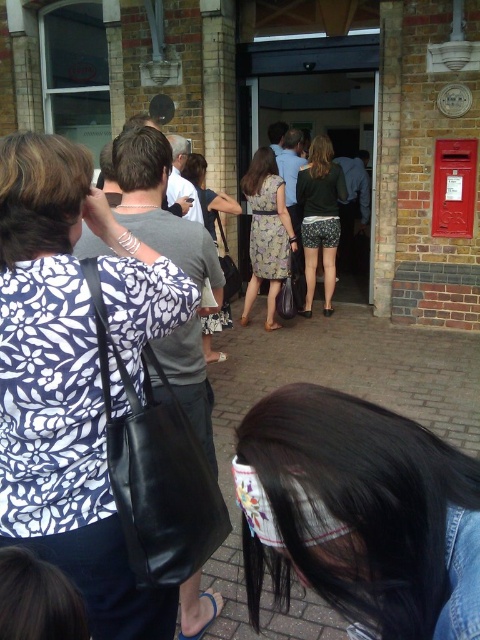
Between black leather hair at center and floral dress at center, which one is positioned higher?

floral dress at center

Does black leather hair at center have a greater width compared to floral dress at center?

Incorrect, black leather hair at center's width does not surpass floral dress at center's.

The width and height of the screenshot is (480, 640). I want to click on black leather hair at center, so click(359, 515).

Is black leather hair at center closer to camera compared to dusty floral dress at center?

Yes, black leather hair at center is closer to the viewer.

Who is higher up, black leather hair at center or dusty floral dress at center?

dusty floral dress at center is above.

The image size is (480, 640). What do you see at coordinates (359, 515) in the screenshot? I see `black leather hair at center` at bounding box center [359, 515].

The width and height of the screenshot is (480, 640). I want to click on black leather hair at center, so point(359,515).

Is floral fabric dress at center closer to the viewer compared to dusty floral dress at center?

That is False.

Between point (331, 195) and point (225, 269), which one is positioned in front?

Point (225, 269)

The image size is (480, 640). What are the coordinates of `floral fabric dress at center` in the screenshot? It's located at (320, 218).